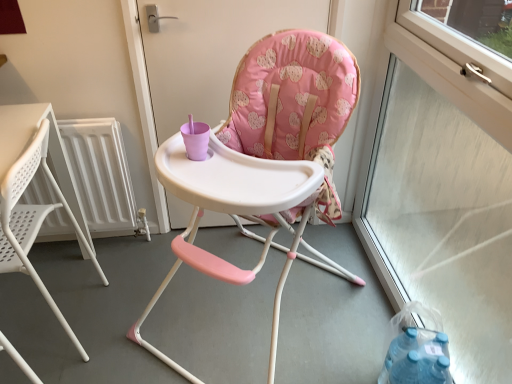
Find the location of a particular element. The image size is (512, 384). free space that is in between matte plastic highchair at center, the 2th chair from the left, and white plastic chair at left, the first chair viewed from the left is located at coordinates (137, 300).